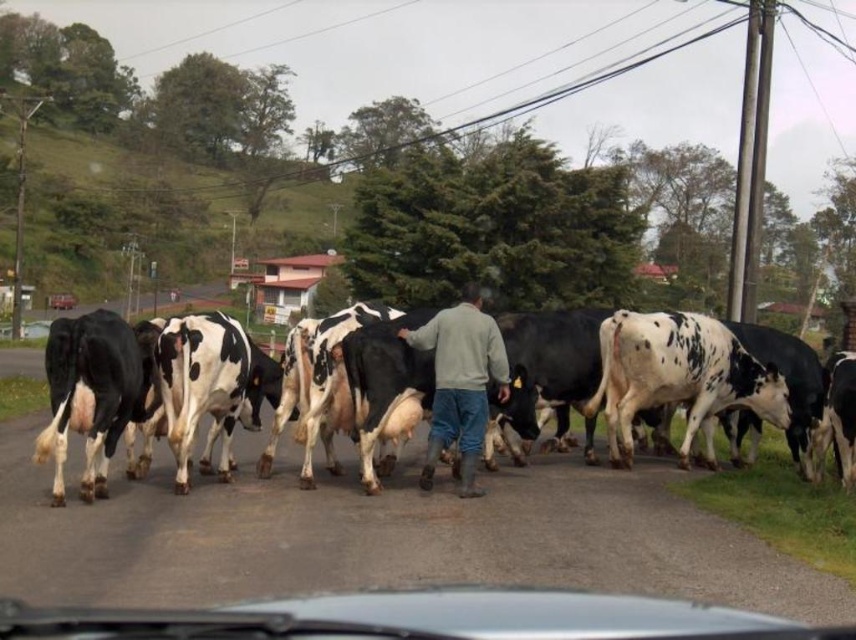
You are a delivery driver who needs to pass through the scene. There is a gray fleece jacket at center and a metallic silver car at center. How far apart are these two objects?

The distance between the gray fleece jacket at center and the metallic silver car at center is 70.22 meters.

You are standing at the camera position and want to throw a small stone to the transparent glass windshield at center. Is the distance too far for an average adult to reach?

The transparent glass windshield at center is 4.05 meters away from the camera. An average adult can throw a stone up to approximately 15 meters, so the distance is within reach.

You are a driver approaching the intersection where the herd of cows is moving along the road. You see the transparent glass windshield at center and the metallic silver car at center. Which object is shorter in height?

The transparent glass windshield at center has a lesser height compared to the metallic silver car at center, so the transparent glass windshield at center is shorter in height.